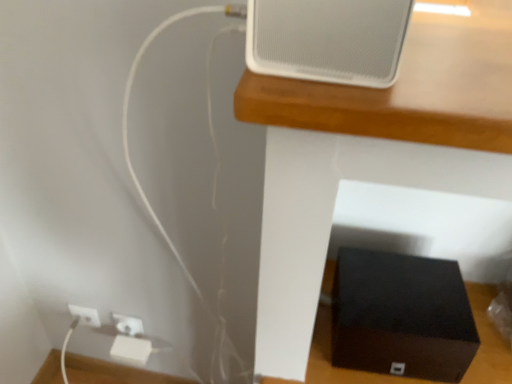
Question: From a real-world perspective, is white plastic electric outlet at lower left positioned above or below white matte speaker at upper center?

Choices:
 (A) above
 (B) below

Answer: (B)

Question: Relative to white matte speaker at upper center, is white plastic electric outlet at lower left in front or behind?

Choices:
 (A) front
 (B) behind

Answer: (B)

Question: Which of these objects is positioned farthest from the white plastic electric outlet at lower left?

Choices:
 (A) white matte speaker at upper center
 (B) black matte speaker at lower center
 (C) black matte box at lower right

Answer: (A)

Question: Which object is positioned farthest from the black matte box at lower right?

Choices:
 (A) white plastic electric outlet at lower left
 (B) white matte speaker at upper center
 (C) black matte speaker at lower center

Answer: (A)